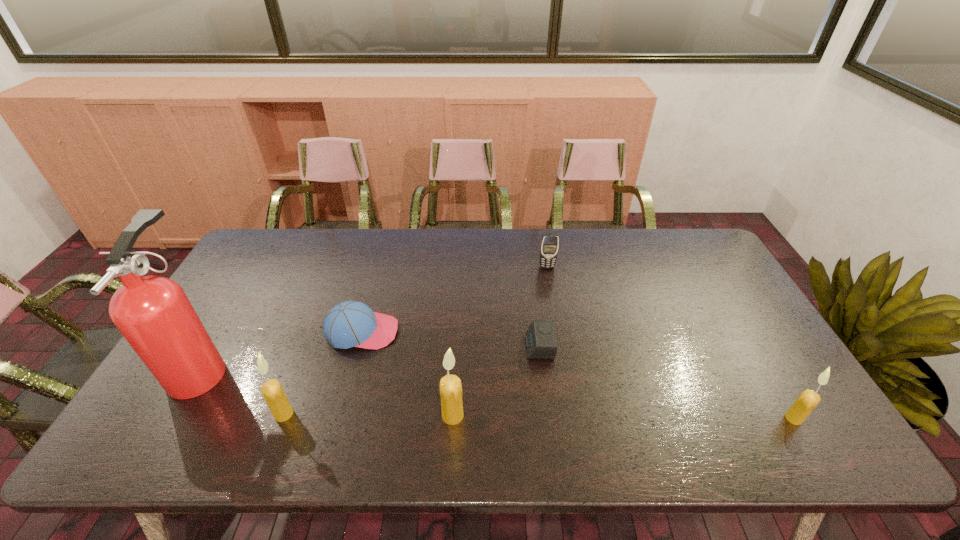
Where is `fire extinguisher`? Image resolution: width=960 pixels, height=540 pixels. fire extinguisher is located at coordinates [x=153, y=313].

Image resolution: width=960 pixels, height=540 pixels. Identify the location of the shortest object. (540, 338).

Identify the location of free space located 0.090m on the right of the leftmost candle. (330, 414).

Identify the location of vacant space located on the right of the second candle from right to left. This screenshot has height=540, width=960. (535, 415).

Locate an element on the screen. vacant space located 0.050m on the left of the shortest candle is located at coordinates (765, 418).

What are the coordinates of `vacant space located on the front face of the fifth tallest object` in the screenshot? It's located at (561, 346).

The width and height of the screenshot is (960, 540). In order to click on vacant space located 0.350m on the front-facing side of the sixth tallest object in this screenshot , I will do `click(520, 332)`.

Where is `free space located on the right of the leftmost object`? The width and height of the screenshot is (960, 540). free space located on the right of the leftmost object is located at coordinates pos(336,368).

Where is `vacant area located on the front-facing side of the shortest object`? Image resolution: width=960 pixels, height=540 pixels. vacant area located on the front-facing side of the shortest object is located at coordinates (385, 347).

Locate an element on the screen. vacant space located on the front-facing side of the shortest object is located at coordinates (457, 347).